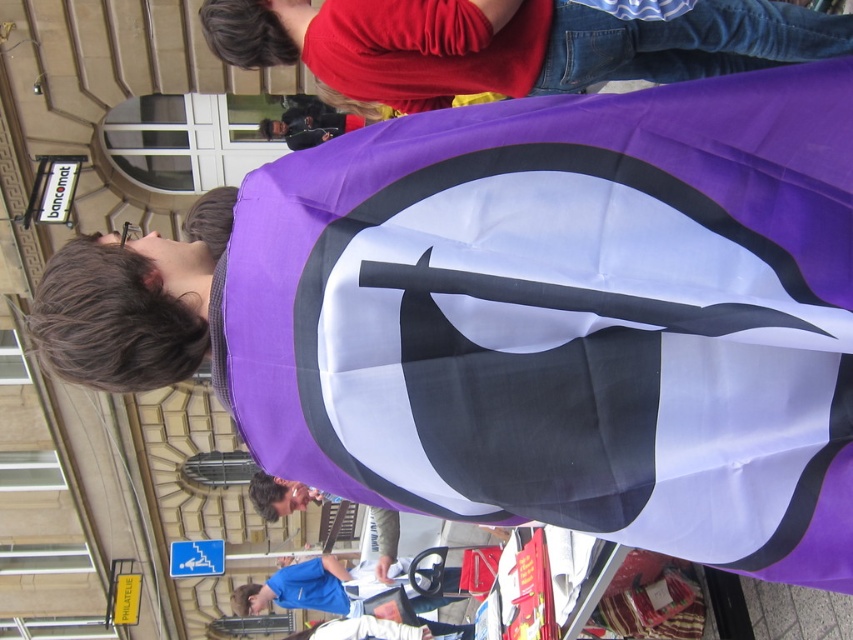
You are a tailor measuring fabrics for a costume. You have two pieces of purple fabric in front of you, the purple fabric flag at center and the purple fabric at upper center. The costume requires the two pieces to be connected with a seam. What is the minimum length of fabric you need to connect them?

The purple fabric flag at center and purple fabric at upper center are 23.09 feet apart. To connect them with a seam, the minimum length of fabric needed is at least 23.09 feet to cover the distance between them.

You are a delivery drone trying to navigate through the scene. The purple fabric flag at center is at coordinates point 0.497, 0.668. Is the flag positioned in the central area of the image?

The purple fabric flag at center is located at point (569, 317), which corresponds to the central area of the image, so yes, it is positioned in the central area.